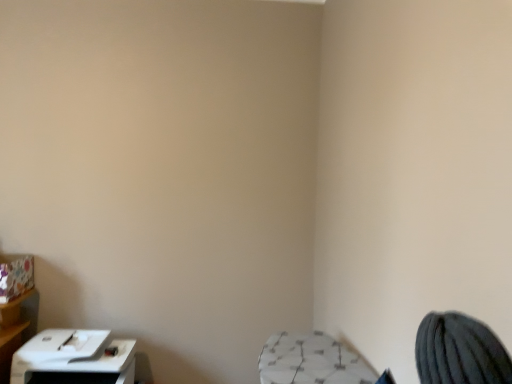
Find the location of a particular element. Image resolution: width=512 pixels, height=384 pixels. white plastic printer at lower left is located at coordinates (74, 358).

Based on the photo, measure the distance between white plastic printer at lower left and camera.

The distance of white plastic printer at lower left from camera is 6.05 feet.

Describe the element at coordinates (74, 358) in the screenshot. I see `white plastic printer at lower left` at that location.

Find the location of `white plastic printer at lower left`. white plastic printer at lower left is located at coordinates [74, 358].